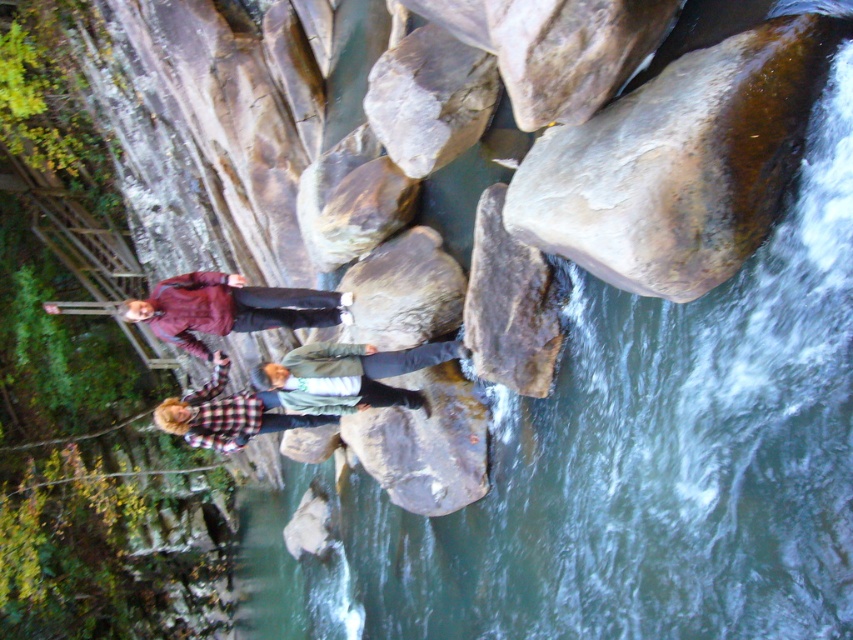
Question: Which of these objects is positioned closest to the rough gray rock at center?

Choices:
 (A) smooth brown rock at center
 (B) rough textured rock at upper center
 (C) maroon fabric jacket at upper left

Answer: (A)

Question: Which point is closer to the camera?

Choices:
 (A) brown smooth rock at upper right
 (B) rough gray rock at center

Answer: (A)

Question: Among these objects, which one is nearest to the camera?

Choices:
 (A) smooth brown rock at center
 (B) rough gray rock at center
 (C) maroon fabric jacket at upper left
 (D) brown rough rock at center

Answer: (A)

Question: Is rough gray rock at center smaller than maroon fabric jacket at upper left?

Choices:
 (A) no
 (B) yes

Answer: (A)

Question: Is smooth brown rock at center to the left of rough gray rock at center from the viewer's perspective?

Choices:
 (A) yes
 (B) no

Answer: (B)

Question: Considering the relative positions of rough textured rock at upper center and maroon fabric jacket at upper left in the image provided, where is rough textured rock at upper center located with respect to maroon fabric jacket at upper left?

Choices:
 (A) above
 (B) below

Answer: (A)